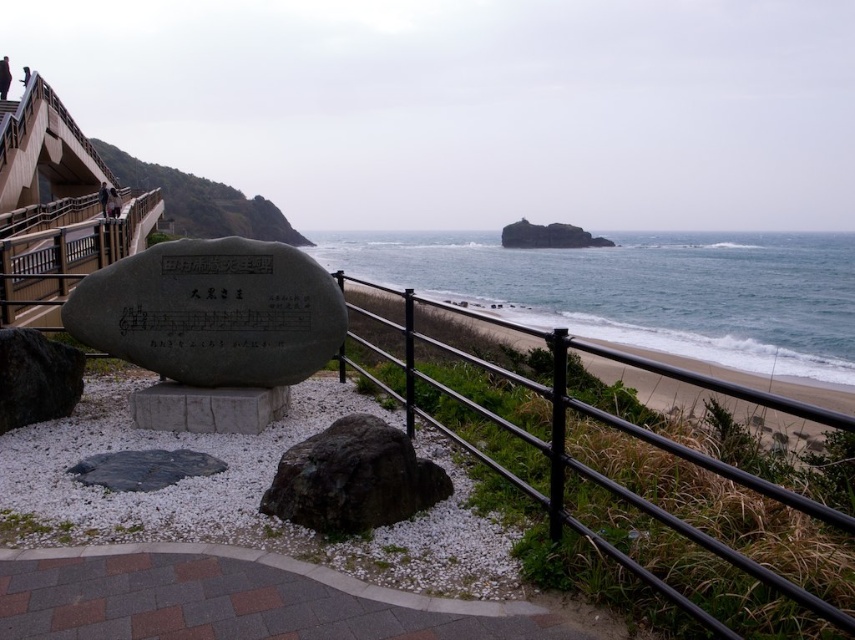
Is black stone at center thinner than black metal fence at center?

Yes.

Does black stone at center have a smaller size compared to black metal fence at center?

Correct, black stone at center occupies less space than black metal fence at center.

In order to click on black stone at center in this screenshot , I will do click(211, 328).

Is point (836, 616) closer to camera compared to point (338, 472)?

Yes, it is.

At what (x,y) coordinates should I click in order to perform the action: click on black metal fence at center. Please return your answer as a coordinate pair (x, y). This screenshot has height=640, width=855. Looking at the image, I should click on (593, 468).

Between dark brown rock at center and dark gray rock at lower left, which one has more height?

dark gray rock at lower left is taller.

Can you confirm if dark brown rock at center is positioned below dark gray rock at lower left?

Yes.

Between point (332, 515) and point (81, 355), which one is positioned behind?

The point (81, 355) is more distant.

Identify the location of dark brown rock at center. (352, 477).